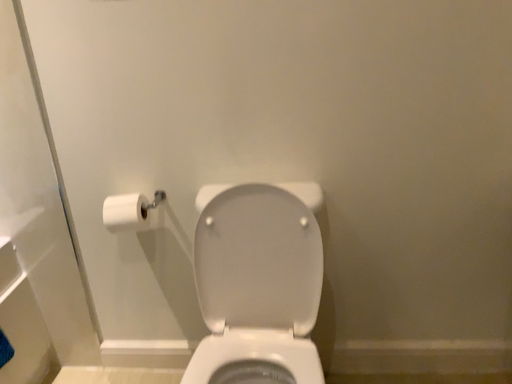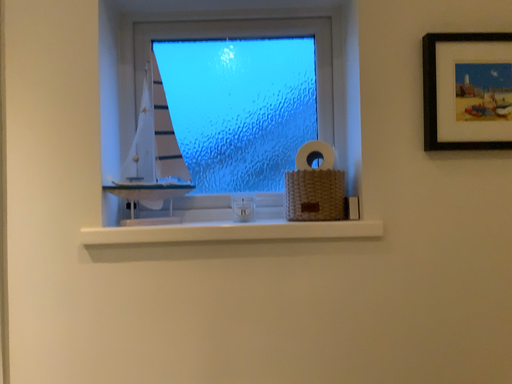
Question: How did the camera likely rotate when shooting the video?

Choices:
 (A) rotated downward
 (B) rotated upward

Answer: (B)